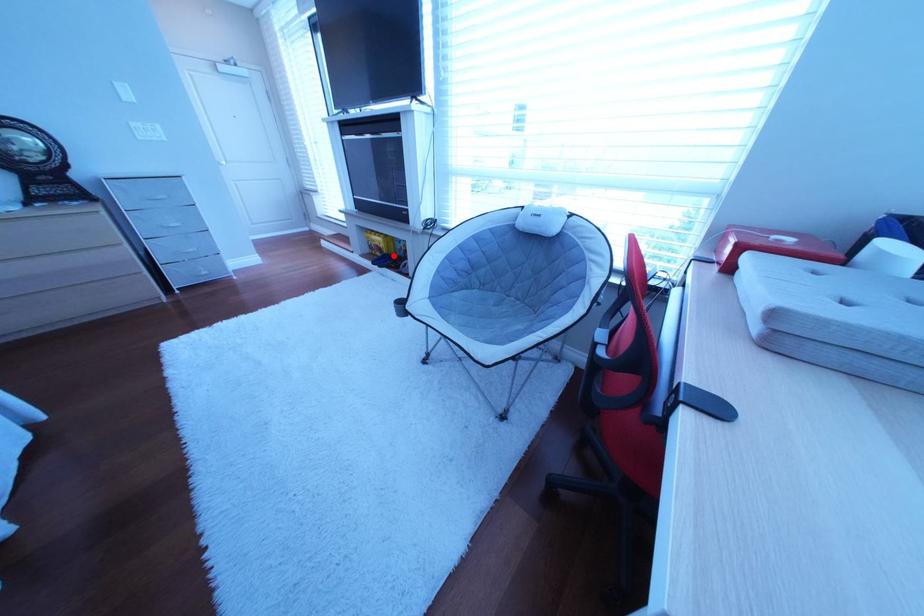
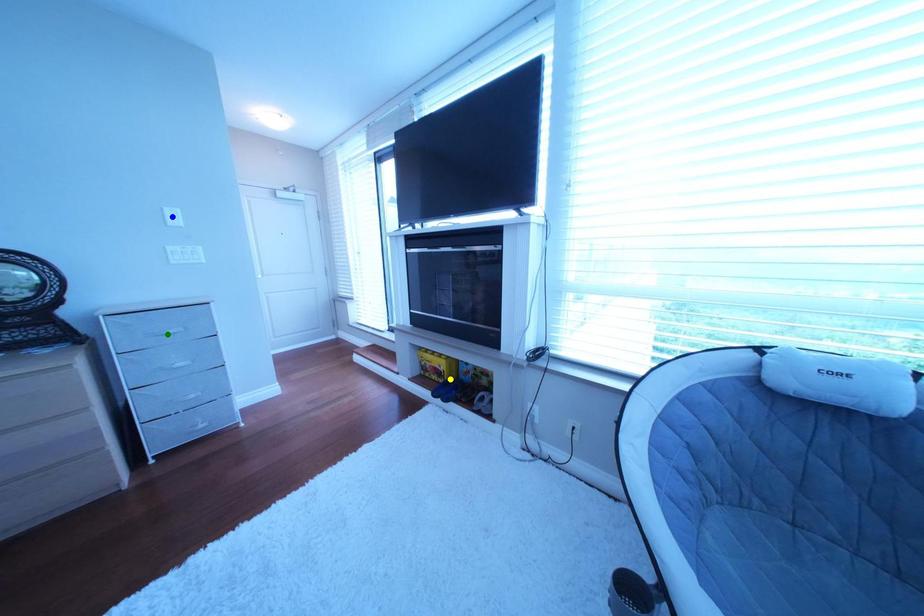
Question: I am providing you with two images of the same scene from different viewpoints. A red point is marked on the first image. You are given multiple points on the second image. Which spot in image 2 lines up with the point in image 1?

Choices:
 (A) green point
 (B) yellow point
 (C) blue point

Answer: (B)